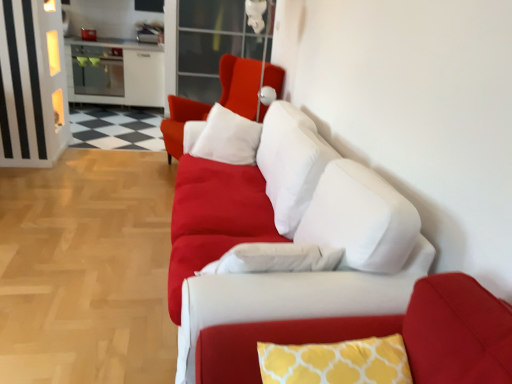
The image size is (512, 384). What do you see at coordinates (240, 84) in the screenshot? I see `matte white cushion at center` at bounding box center [240, 84].

This screenshot has width=512, height=384. What do you see at coordinates (215, 43) in the screenshot? I see `transparent glass door at upper center` at bounding box center [215, 43].

The width and height of the screenshot is (512, 384). What are the coordinates of `white soft pillow at center` in the screenshot? It's located at (227, 138).

You are a GUI agent. You are given a task and a screenshot of the screen. Output one action in this format:
    pyautogui.click(x=<x>, y=<y>)
    Task: Click on the yellow printed cushion at center
    This screenshot has width=512, height=384.
    Given the screenshot: What is the action you would take?
    pyautogui.click(x=385, y=335)

The image size is (512, 384). I want to click on matte white cushion at center, so click(240, 84).

Is point (147, 92) closer to viewer compared to point (236, 132)?

No, (147, 92) is further to viewer.

How different are the orientations of white glossy cabinet at upper left and white soft pillow at center in degrees?

They differ by 8.43 degrees in their facing directions.

From the picture: Between white glossy cabinet at upper left and white soft pillow at center, which one has more height?

Answer: white glossy cabinet at upper left.

Is white soft pillow at center at the back of white glossy cabinet at upper left?

white glossy cabinet at upper left is not turned away from white soft pillow at center.

Is yellow printed cushion at center oriented away from white soft pillow at center?

Yes, white soft pillow at center is at the back of yellow printed cushion at center.

Is yellow printed cushion at center not near white soft pillow at center?

yellow printed cushion at center is far away from white soft pillow at center.

Considering the relative sizes of yellow printed cushion at center and white soft pillow at center in the image provided, is yellow printed cushion at center wider than white soft pillow at center?

Incorrect, the width of yellow printed cushion at center does not surpass that of white soft pillow at center.

Which is more to the left, matte white cushion at center or white glossy cabinet at upper left?

Positioned to the left is white glossy cabinet at upper left.

Does point (236, 95) appear closer or farther from the camera than point (124, 86)?

Clearly, point (236, 95) is closer to the camera than point (124, 86).

How different are the orientations of matte white cushion at center and white glossy cabinet at upper left in degrees?

matte white cushion at center and white glossy cabinet at upper left are facing 62.6 degrees away from each other.

Is white glossy cabinet at upper left at the back of matte white cushion at center?

matte white cushion at center is not turned away from white glossy cabinet at upper left.

Considering the points (280, 80) and (219, 330), which point is behind, point (280, 80) or point (219, 330)?

Point (280, 80)

Is matte white cushion at center directly adjacent to yellow printed cushion at center?

No, matte white cushion at center is not in contact with yellow printed cushion at center.

From the image's perspective, which object appears higher, matte white cushion at center or yellow printed cushion at center?

matte white cushion at center, from the image's perspective.

Are matte white cushion at center and white soft pillow at center making contact?

No, matte white cushion at center is not touching white soft pillow at center.

Considering the sizes of objects matte white cushion at center and white soft pillow at center in the image provided, who is thinner, matte white cushion at center or white soft pillow at center?

With smaller width is white soft pillow at center.

From the image's perspective, which is above, matte white cushion at center or white soft pillow at center?

matte white cushion at center.

Is matte white cushion at center facing towards white soft pillow at center?

No, matte white cushion at center is not facing towards white soft pillow at center.

Is yellow printed cushion at center not close to matte white couch at center?

No, there isn't a large distance between yellow printed cushion at center and matte white couch at center.

Is yellow printed cushion at center oriented towards matte white couch at center?

No, yellow printed cushion at center does not turn towards matte white couch at center.

From a real-world perspective, who is located lower, yellow printed cushion at center or matte white couch at center?

From a 3D spatial view, matte white couch at center is below.

Which of these two, yellow printed cushion at center or matte white couch at center, is bigger?

matte white couch at center.

From the picture: Does white glossy cabinet at upper left come in front of yellow printed cushion at center?

No, white glossy cabinet at upper left is further to the viewer.

Is white glossy cabinet at upper left not near yellow printed cushion at center?

white glossy cabinet at upper left is far away from yellow printed cushion at center.

Image resolution: width=512 pixels, height=384 pixels. I want to click on entertainment center beneath the yellow printed cushion at center (from a real-world perspective), so click(115, 72).

The width and height of the screenshot is (512, 384). I want to click on entertainment center that appears above the white soft pillow at center (from the image's perspective), so click(x=115, y=72).

Identify the location of couch above the white soft pillow at center (from a real-world perspective). The width and height of the screenshot is (512, 384). (385, 335).

When comparing their distances from white glossy cabinet at upper left, does yellow printed cushion at center or white soft pillow at center seem closer?

white soft pillow at center lies closer to white glossy cabinet at upper left than the other object.

When comparing their distances from transparent glass door at upper center, does yellow printed cushion at center or white glossy cabinet at upper left seem closer?

white glossy cabinet at upper left is closer to transparent glass door at upper center.

When comparing their distances from matte white couch at center, does white soft pillow at center or transparent glass door at upper center seem closer?

white soft pillow at center lies closer to matte white couch at center than the other object.

Considering their positions, is yellow printed cushion at center positioned closer to white soft pillow at center than transparent glass door at upper center?

yellow printed cushion at center lies closer to white soft pillow at center than the other object.

From the image, which object appears to be farther from yellow printed cushion at center, transparent glass door at upper center or white soft pillow at center?

transparent glass door at upper center is positioned further to the anchor yellow printed cushion at center.

Considering their positions, is white glossy cabinet at upper left positioned further to matte white couch at center than transparent glass door at upper center?

Based on the image, white glossy cabinet at upper left appears to be further to matte white couch at center.

In the scene shown: Estimate the real-world distances between objects in this image. Which object is closer to white soft pillow at center, transparent glass door at upper center or matte white cushion at center?

Among the two, matte white cushion at center is located nearer to white soft pillow at center.

When comparing their distances from white soft pillow at center, does matte white cushion at center or matte white couch at center seem closer?

Based on the image, matte white cushion at center appears to be nearer to white soft pillow at center.

Where is `chair between yellow printed cushion at center and transparent glass door at upper center in the front-back direction`? Image resolution: width=512 pixels, height=384 pixels. chair between yellow printed cushion at center and transparent glass door at upper center in the front-back direction is located at coordinates (240, 84).

In order to click on chair located between matte white couch at center and white glossy cabinet at upper left in the depth direction in this screenshot , I will do `click(240, 84)`.

Locate an element on the screen. This screenshot has width=512, height=384. pillow positioned between yellow printed cushion at center and white glossy cabinet at upper left from near to far is located at coordinates (227, 138).

Image resolution: width=512 pixels, height=384 pixels. I want to click on pillow between matte white couch at center and white glossy cabinet at upper left in the front-back direction, so click(227, 138).